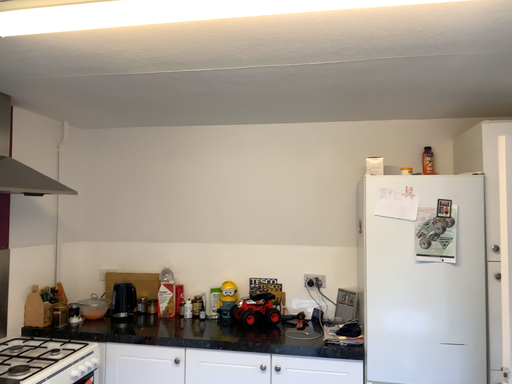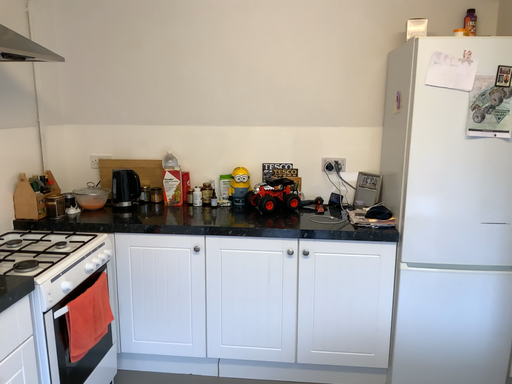
Question: Which way did the camera rotate in the video?

Choices:
 (A) rotated downward
 (B) rotated upward

Answer: (A)